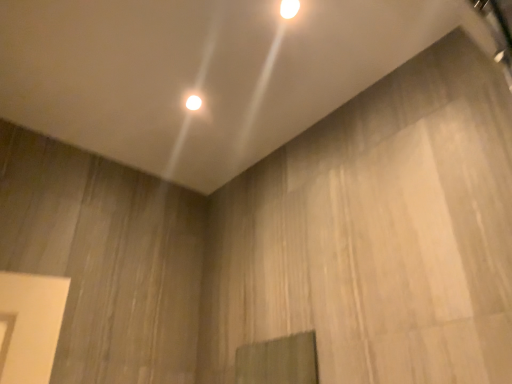
Question: From a real-world perspective, does white glossy light fixture at upper center, the 2th lamp positioned from the back, sit lower than white glossy light fixture at upper center, acting as the 2th lamp starting from the right?

Choices:
 (A) yes
 (B) no

Answer: (A)

Question: Is white glossy light fixture at upper center, which appears as the second lamp when ordered from the bottom, to the left of white glossy light fixture at upper center, which is the 2th lamp in top-to-bottom order, from the viewer's perspective?

Choices:
 (A) yes
 (B) no

Answer: (B)

Question: Is white glossy light fixture at upper center, which is counted as the 1th lamp, starting from the front, taller than white glossy light fixture at upper center, the first lamp in the back-to-front sequence?

Choices:
 (A) no
 (B) yes

Answer: (B)

Question: From a real-world perspective, is white glossy light fixture at upper center, positioned as the first lamp in top-to-bottom order, physically above white glossy light fixture at upper center, acting as the 2th lamp starting from the right?

Choices:
 (A) yes
 (B) no

Answer: (B)

Question: Is white glossy light fixture at upper center, the 2th lamp positioned from the left, positioned before white glossy light fixture at upper center, which is the 2th lamp in top-to-bottom order?

Choices:
 (A) no
 (B) yes

Answer: (B)

Question: Considering the relative sizes of white glossy light fixture at upper center, which is counted as the 1th lamp, starting from the front, and white glossy light fixture at upper center, the first lamp in the back-to-front sequence, in the image provided, is white glossy light fixture at upper center, which is counted as the 1th lamp, starting from the front, bigger than white glossy light fixture at upper center, the first lamp in the back-to-front sequence,?

Choices:
 (A) no
 (B) yes

Answer: (B)

Question: Is white glossy light fixture at upper center, positioned as the first lamp in bottom-to-top order, positioned with its back to white glossy light fixture at upper center, the 2th lamp positioned from the left?

Choices:
 (A) yes
 (B) no

Answer: (B)

Question: From a real-world perspective, is white glossy light fixture at upper center, the first lamp in the back-to-front sequence, positioned over white glossy light fixture at upper center, positioned as the first lamp in top-to-bottom order, based on gravity?

Choices:
 (A) no
 (B) yes

Answer: (B)

Question: Does white glossy light fixture at upper center, which is the 2th lamp in top-to-bottom order, have a smaller size compared to white glossy light fixture at upper center, which is counted as the 1th lamp, starting from the front?

Choices:
 (A) no
 (B) yes

Answer: (B)

Question: Is white glossy light fixture at upper center, the first lamp in the back-to-front sequence, not within white glossy light fixture at upper center, positioned as the first lamp in top-to-bottom order?

Choices:
 (A) yes
 (B) no

Answer: (A)

Question: Can you confirm if white glossy light fixture at upper center, acting as the 2th lamp starting from the right, is taller than white glossy light fixture at upper center, which appears as the second lamp when ordered from the bottom?

Choices:
 (A) yes
 (B) no

Answer: (B)

Question: Can you confirm if white glossy light fixture at upper center, acting as the 2th lamp starting from the right, is positioned to the left of white glossy light fixture at upper center, which appears as the second lamp when ordered from the bottom?

Choices:
 (A) no
 (B) yes

Answer: (B)

Question: In terms of width, does white glossy light fixture at upper center, the 2th lamp positioned from the back, look wider or thinner when compared to white glossy light fixture at upper center, which is the 2th lamp in top-to-bottom order?

Choices:
 (A) wide
 (B) thin

Answer: (B)